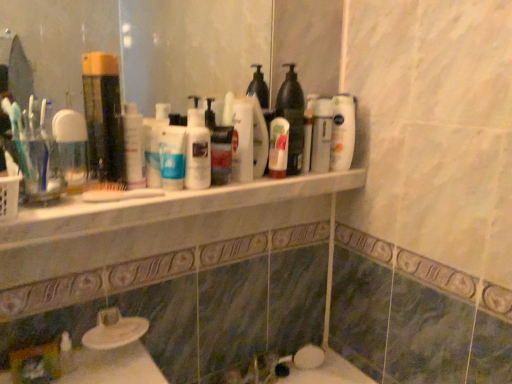
Question: Is translucent plastic mouthwash at left, placed as the 2th mouthwash when sorted from left to right, surrounding white marble counter at center?

Choices:
 (A) yes
 (B) no

Answer: (B)

Question: Would you say translucent plastic mouthwash at left, positioned as the first mouthwash in right-to-left order, is outside white marble counter at center?

Choices:
 (A) yes
 (B) no

Answer: (A)

Question: Is translucent plastic mouthwash at left, positioned as the first mouthwash in right-to-left order, far from white marble counter at center?

Choices:
 (A) yes
 (B) no

Answer: (B)

Question: From a real-world perspective, is translucent plastic mouthwash at left, placed as the 2th mouthwash when sorted from left to right, on top of white marble counter at center?

Choices:
 (A) yes
 (B) no

Answer: (A)

Question: From the image's perspective, is translucent plastic mouthwash at left, placed as the 2th mouthwash when sorted from left to right, above white marble counter at center?

Choices:
 (A) yes
 (B) no

Answer: (A)

Question: Considering the positions of white glossy lotion at center, marked as the second toiletry in a right-to-left arrangement, and white glossy lotion at center, marked as the fifth cleaning product in a right-to-left arrangement, in the image, is white glossy lotion at center, marked as the second toiletry in a right-to-left arrangement, taller or shorter than white glossy lotion at center, marked as the fifth cleaning product in a right-to-left arrangement,?

Choices:
 (A) short
 (B) tall

Answer: (A)

Question: In terms of size, does white glossy lotion at center, the 2th toiletry viewed from the back, appear bigger or smaller than white glossy lotion at center, the first cleaning product positioned from the left?

Choices:
 (A) small
 (B) big

Answer: (A)

Question: Which is correct: white glossy lotion at center, the first toiletry when ordered from left to right, is inside white glossy lotion at center, marked as the fifth cleaning product in a right-to-left arrangement, or outside of it?

Choices:
 (A) outside
 (B) inside

Answer: (A)

Question: In terms of width, does white glossy lotion at center, the 2th toiletry viewed from the back, look wider or thinner when compared to white glossy lotion at center, marked as the fifth cleaning product in a right-to-left arrangement?

Choices:
 (A) thin
 (B) wide

Answer: (A)

Question: Considering the positions of clear glass mirror at upper center and translucent plastic bottle at upper center, the 2th cleaning product viewed from the right, in the image, is clear glass mirror at upper center taller or shorter than translucent plastic bottle at upper center, the 2th cleaning product viewed from the right,?

Choices:
 (A) tall
 (B) short

Answer: (A)

Question: Considering the positions of clear glass mirror at upper center and translucent plastic bottle at upper center, acting as the 4th cleaning product starting from the left, in the image, is clear glass mirror at upper center bigger or smaller than translucent plastic bottle at upper center, acting as the 4th cleaning product starting from the left,?

Choices:
 (A) small
 (B) big

Answer: (B)

Question: From the image's perspective, is clear glass mirror at upper center above or below translucent plastic bottle at upper center, the 2th cleaning product viewed from the right?

Choices:
 (A) above
 (B) below

Answer: (A)

Question: Is clear glass mirror at upper center wider or thinner than translucent plastic bottle at upper center, the 2th cleaning product viewed from the right?

Choices:
 (A) wide
 (B) thin

Answer: (B)

Question: Visually, is translucent plastic bottle at upper center, acting as the 4th cleaning product starting from the left, positioned to the left or to the right of white glossy lotion at center, marked as the fifth cleaning product in a right-to-left arrangement?

Choices:
 (A) left
 (B) right

Answer: (B)

Question: Looking at their shapes, would you say translucent plastic bottle at upper center, the 2th cleaning product viewed from the right, is wider or thinner than white glossy lotion at center, marked as the fifth cleaning product in a right-to-left arrangement?

Choices:
 (A) thin
 (B) wide

Answer: (B)